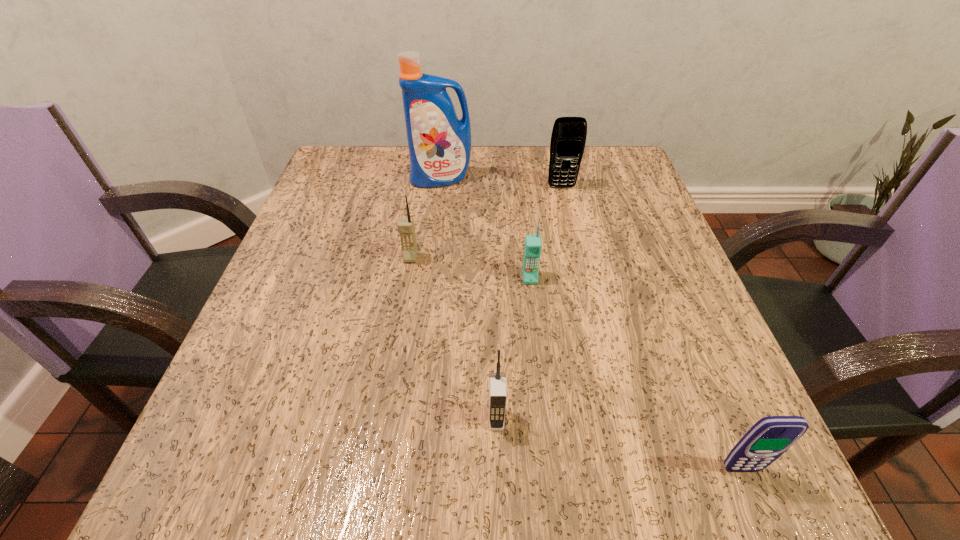
Locate an element on the screen. cellular telephone that is the second closest one to the third nearest cellular telephone is located at coordinates (497, 381).